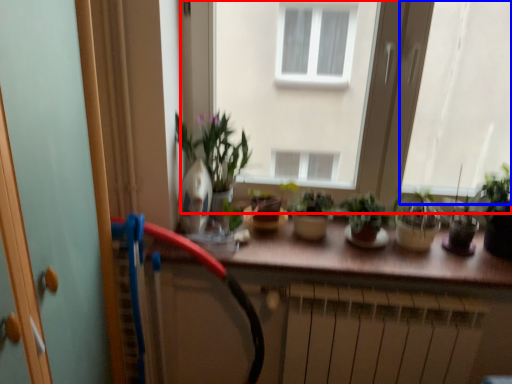
Question: Which object is closer to the camera taking this photo, window (highlighted by a red box) or window (highlighted by a blue box)?

Choices:
 (A) window
 (B) window

Answer: (B)